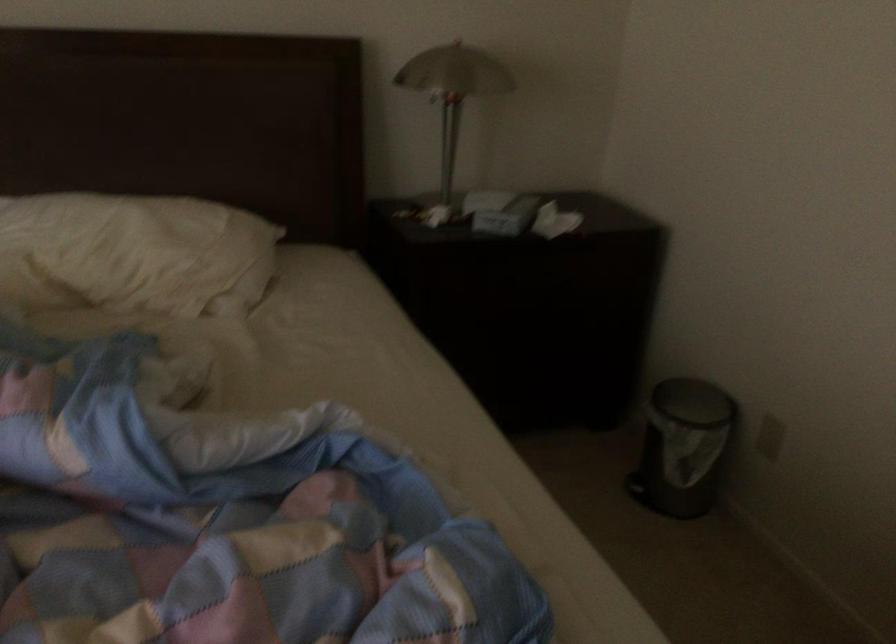
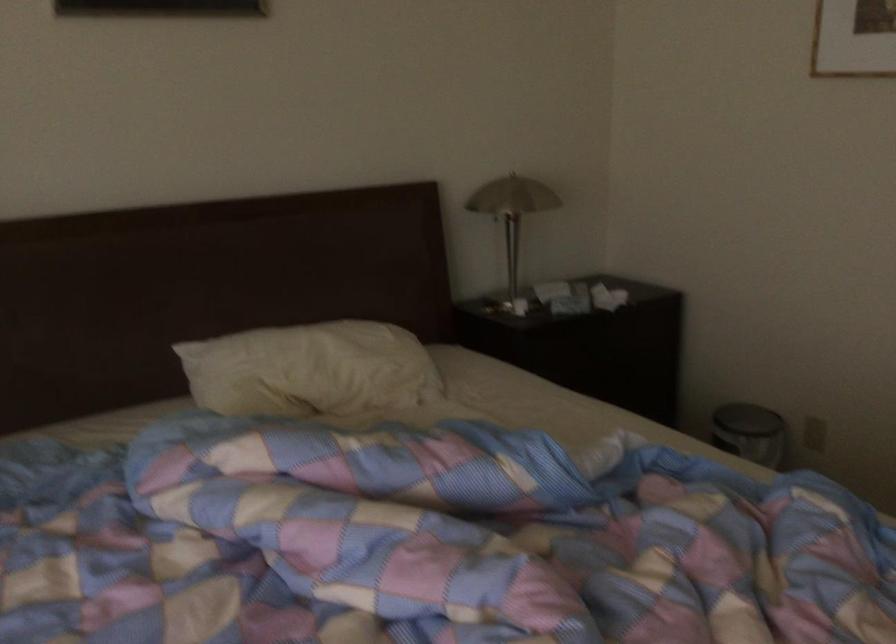
Question: I am providing you with two images of the same scene from different viewpoints. After the viewpoint changes to image2, which objects are now occluded?

Choices:
 (A) small trash can
 (B) metal table lamp
 (C) white pot handle
 (D) trash can pedal

Answer: (D)